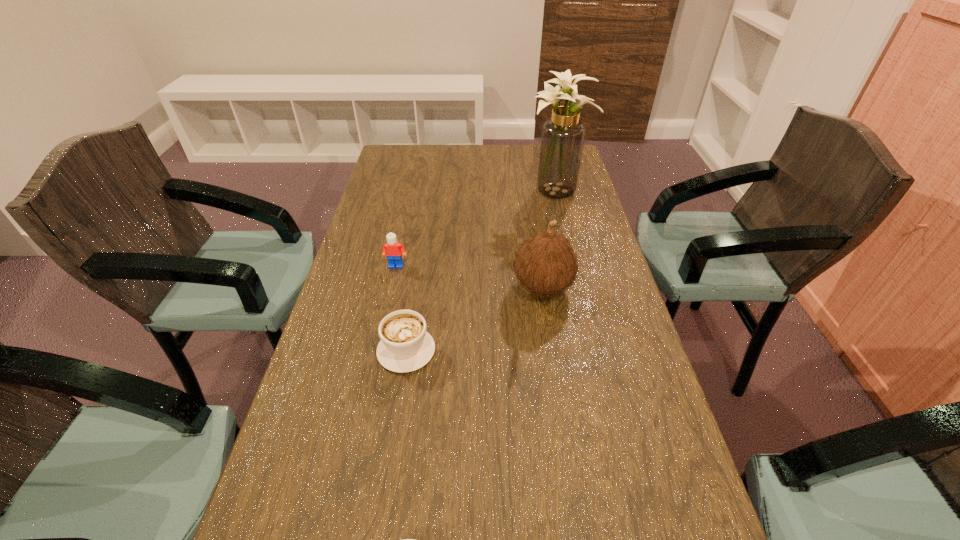
You are a GUI agent. You are given a task and a screenshot of the screen. Output one action in this format:
    pyautogui.click(x=<x>, y=<y>)
    Task: Click on the free space at the right edge of the desktop
    Image resolution: width=960 pixels, height=540 pixels.
    Given the screenshot: What is the action you would take?
    pyautogui.click(x=595, y=263)

In the image, there is a desktop. Identify the location of vacant region at the far left corner. (395, 161).

The width and height of the screenshot is (960, 540). In the image, there is a desktop. What are the coordinates of `free region at the far right corner` in the screenshot? It's located at (535, 156).

Identify the location of free spot between the tallest object and the third shortest object. tap(476, 230).

You are a GUI agent. You are given a task and a screenshot of the screen. Output one action in this format:
    pyautogui.click(x=<x>, y=<y>)
    Task: Click on the free spot between the Lego and the fourth shortest object
    This screenshot has height=540, width=960.
    Given the screenshot: What is the action you would take?
    pyautogui.click(x=469, y=276)

Find the location of a particular element. blank region between the Lego and the coconut is located at coordinates (469, 276).

Find the location of a particular element. The image size is (960, 540). object identified as the fourth closest to the flower arrangement is located at coordinates (404, 539).

Locate an element on the screen. The height and width of the screenshot is (540, 960). object that is the closest one to the shortest object is located at coordinates (405, 346).

The height and width of the screenshot is (540, 960). I want to click on free space in the image that satisfies the following two spatial constraints: 1. to the right of the tallest object's handle; 2. on the right side of the second shortest object, so click(x=431, y=193).